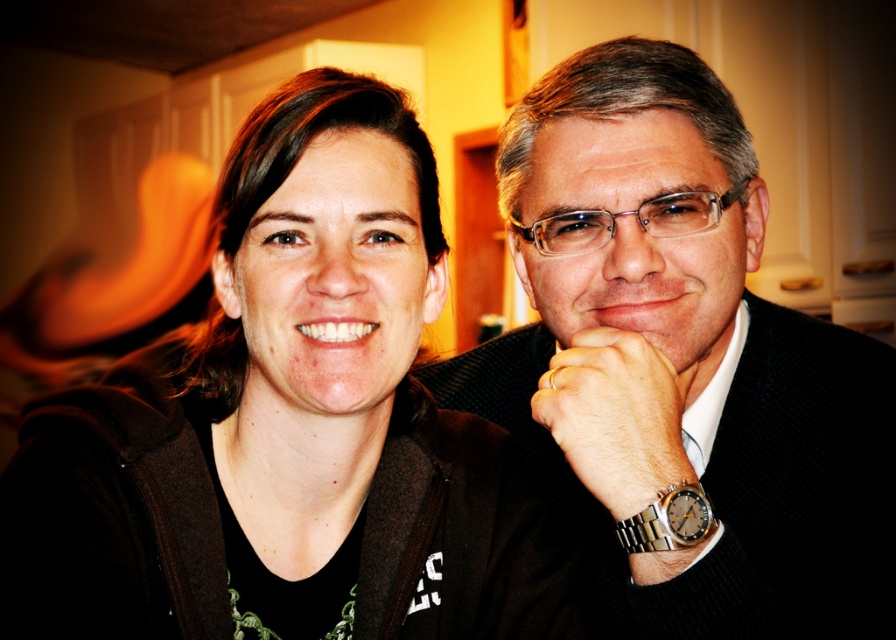
Question: Does matte black jacket at left have a larger size compared to black textured suit at center?

Choices:
 (A) yes
 (B) no

Answer: (B)

Question: Is black textured suit at center to the left of metallic gold ring at center from the viewer's perspective?

Choices:
 (A) no
 (B) yes

Answer: (A)

Question: Among these points, which one is nearest to the camera?

Choices:
 (A) (670, 465)
 (B) (597, 314)
 (C) (285, 592)

Answer: (A)

Question: Among these points, which one is nearest to the camera?

Choices:
 (A) (480, 547)
 (B) (621, 392)

Answer: (B)

Question: Observing the image, what is the correct spatial positioning of black textured suit at center in reference to metallic gold ring at center?

Choices:
 (A) left
 (B) right

Answer: (B)

Question: Which object is farther from the camera taking this photo?

Choices:
 (A) matte black jacket at left
 (B) black textured suit at center

Answer: (B)